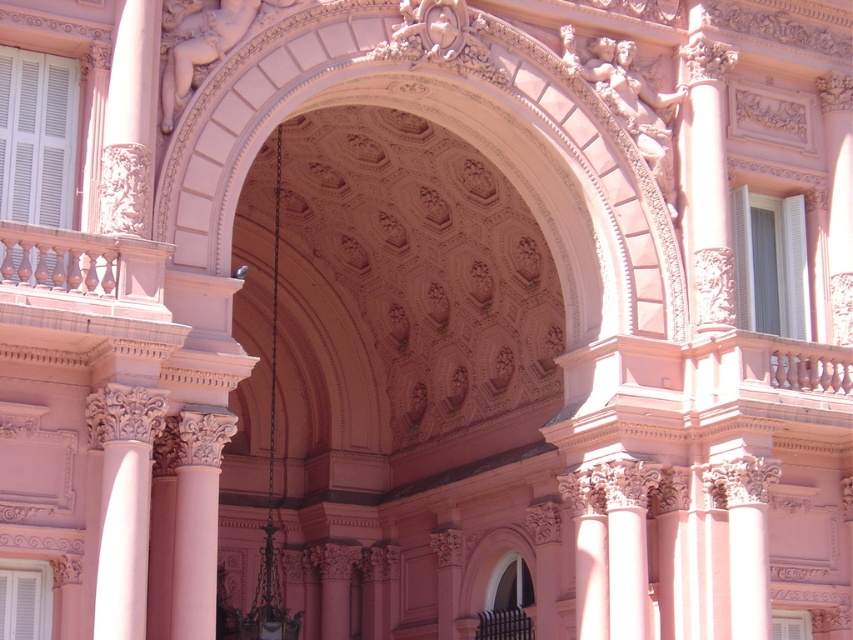
Question: Is white carved column at center thinner than smooth pink column at center?

Choices:
 (A) no
 (B) yes

Answer: (B)

Question: Which object is positioned farthest from the smooth pink column at center?

Choices:
 (A) white carved column at center
 (B) smooth pink railing at left

Answer: (B)

Question: Which is farther from the smooth pink railing at left?

Choices:
 (A) white carved column at center
 (B) pink marble column at center

Answer: (B)

Question: Can you confirm if smooth pink railing at left is positioned below pink marble column at center?

Choices:
 (A) no
 (B) yes

Answer: (A)

Question: Which point appears farthest from the camera in this image?

Choices:
 (A) (135, 451)
 (B) (193, 544)

Answer: (B)

Question: Is smooth pink railing at left closer to the viewer compared to white carved column at center?

Choices:
 (A) yes
 (B) no

Answer: (A)